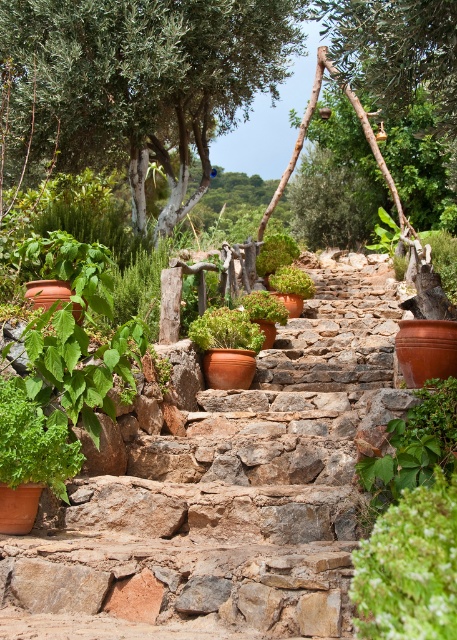
Who is lower down, terracotta stone stairs at center or green leafy tree at upper center?

terracotta stone stairs at center is lower down.

Which is in front, point (335, 595) or point (138, 67)?

Point (335, 595) is more forward.

You are a GUI agent. You are given a task and a screenshot of the screen. Output one action in this format:
    pyautogui.click(x=<x>, y=<y>)
    Task: Click on the terracotta stone stairs at center
    This screenshot has width=457, height=640.
    Given the screenshot: What is the action you would take?
    pyautogui.click(x=223, y=493)